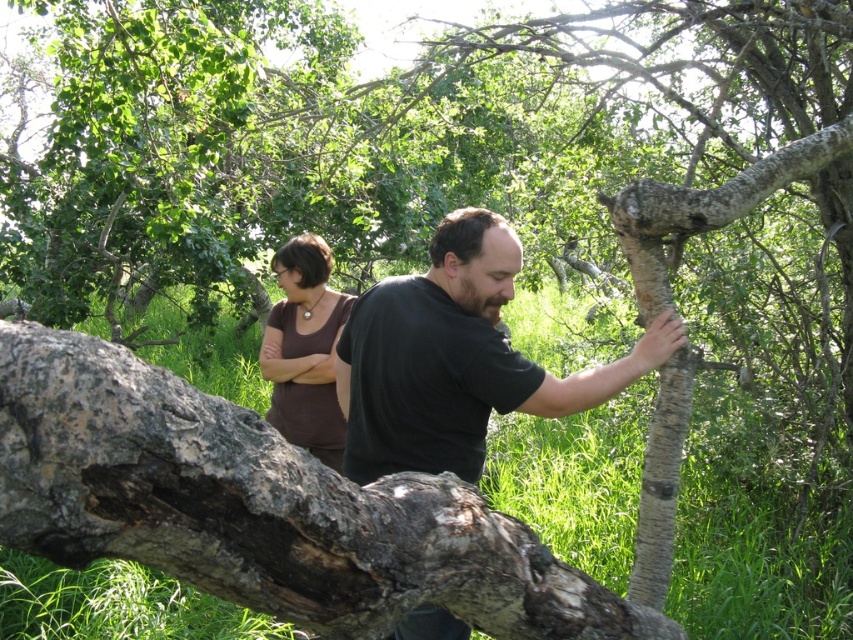
You are standing in the natural setting shown in the image and want to place a small marker between the two points, point (x=660, y=444) and point (x=682, y=216). Which point is closer to you so that you can place the marker in front of both points?

Point (x=682, y=216) is closer to you, so placing the marker in front of both points would require positioning it closer to this point since it is nearer than point (x=660, y=444) which is further away.

You are a photographer trying to capture both the dark brown wood tree trunk at center and the brown matte shirt at center in the same frame. Based on their positions, will the tree trunk appear closer to the camera than the shirt?

Yes, the dark brown wood tree trunk at center is in front of brown matte shirt at center, so it will appear closer to the camera in the photo.